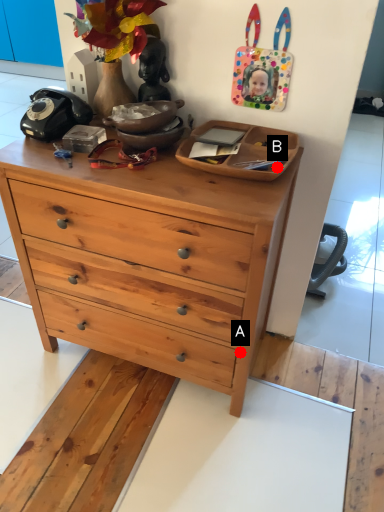
Question: Two points are circled on the image, labeled by A and B beside each circle. Which point appears farthest from the camera in this image?

Choices:
 (A) A is further
 (B) B is further

Answer: (A)